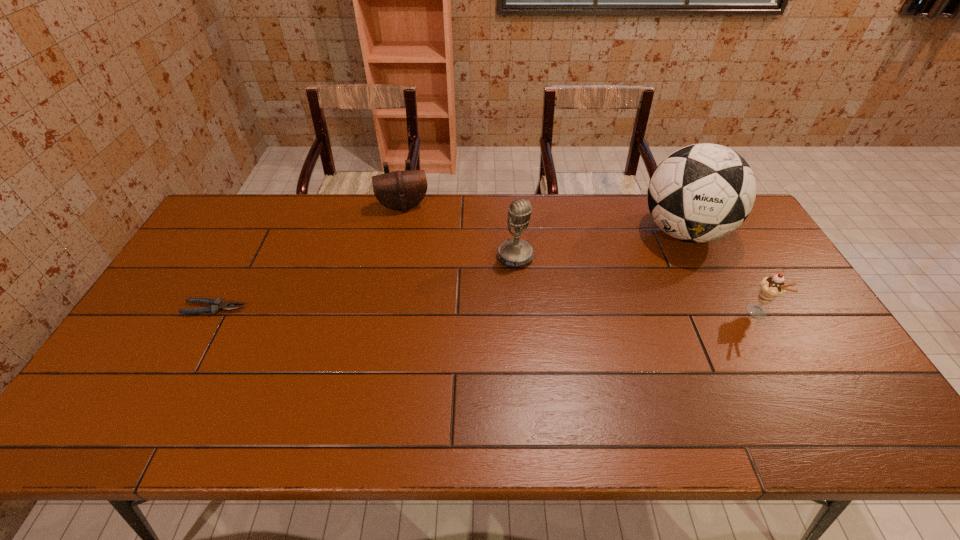
You are a GUI agent. You are given a task and a screenshot of the screen. Output one action in this format:
    pyautogui.click(x=<x>, y=<y>)
    Task: Click on the closest object to the leftmost object
    This screenshot has width=960, height=540.
    Given the screenshot: What is the action you would take?
    pyautogui.click(x=401, y=190)

Locate an element on the screen. The height and width of the screenshot is (540, 960). blank area in the image that satisfies the following two spatial constraints: 1. on the front side of the third object from right to left; 2. on the left side of the pouch is located at coordinates (394, 256).

Where is `vacant space that satisfies the following two spatial constraints: 1. on the back side of the microphone; 2. on the right side of the tallest object`? vacant space that satisfies the following two spatial constraints: 1. on the back side of the microphone; 2. on the right side of the tallest object is located at coordinates (514, 232).

The width and height of the screenshot is (960, 540). In order to click on vacant space that satisfies the following two spatial constraints: 1. on the back side of the third object from left to right; 2. on the right side of the soccer ball in this screenshot , I will do `click(514, 232)`.

Where is `vacant space that satisfies the following two spatial constraints: 1. on the front side of the microphone; 2. on the left side of the pouch`? vacant space that satisfies the following two spatial constraints: 1. on the front side of the microphone; 2. on the left side of the pouch is located at coordinates (394, 256).

Where is `blank area in the image that satisfies the following two spatial constraints: 1. on the front side of the fourth object from right to left; 2. on the left side of the icecream`? The width and height of the screenshot is (960, 540). blank area in the image that satisfies the following two spatial constraints: 1. on the front side of the fourth object from right to left; 2. on the left side of the icecream is located at coordinates (382, 314).